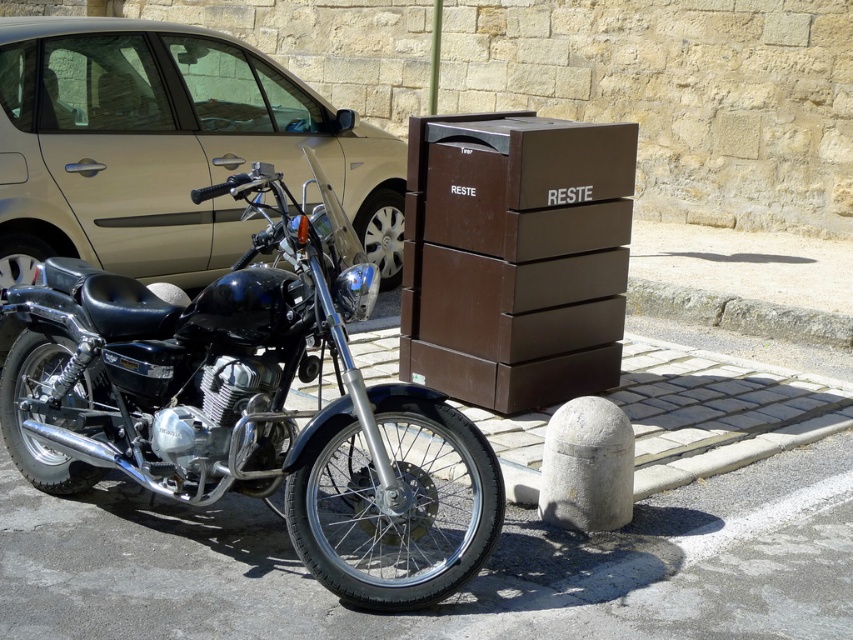
Who is positioned more to the left, shiny black motorcycle at left or metallic gold car at left?

From the viewer's perspective, metallic gold car at left appears more on the left side.

Does shiny black motorcycle at left appear on the right side of metallic gold car at left?

Correct, you'll find shiny black motorcycle at left to the right of metallic gold car at left.

Locate an element on the screen. shiny black motorcycle at left is located at coordinates (253, 404).

Where is `shiny black motorcycle at left`? shiny black motorcycle at left is located at coordinates (253, 404).

Does metallic gold car at left have a greater height compared to brown matte trash bin at center?

Yes, metallic gold car at left is taller than brown matte trash bin at center.

Is metallic gold car at left wider than brown matte trash bin at center?

Indeed, metallic gold car at left has a greater width compared to brown matte trash bin at center.

Between point (16, 225) and point (451, 193), which one is positioned behind?

The point (16, 225) is more distant.

The height and width of the screenshot is (640, 853). I want to click on metallic gold car at left, so click(x=166, y=148).

Does shiny black motorcycle at left have a larger size compared to brown matte trash bin at center?

Indeed, shiny black motorcycle at left has a larger size compared to brown matte trash bin at center.

Is shiny black motorcycle at left positioned behind brown matte trash bin at center?

No.

At what (x,y) coordinates should I click in order to perform the action: click on shiny black motorcycle at left. Please return your answer as a coordinate pair (x, y). The height and width of the screenshot is (640, 853). Looking at the image, I should click on (253, 404).